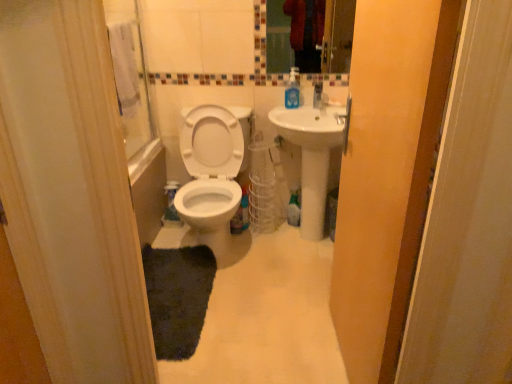
Where is `vacant area situated below white ceramic sink at center (from a real-world perspective)`? This screenshot has width=512, height=384. vacant area situated below white ceramic sink at center (from a real-world perspective) is located at coordinates (298, 240).